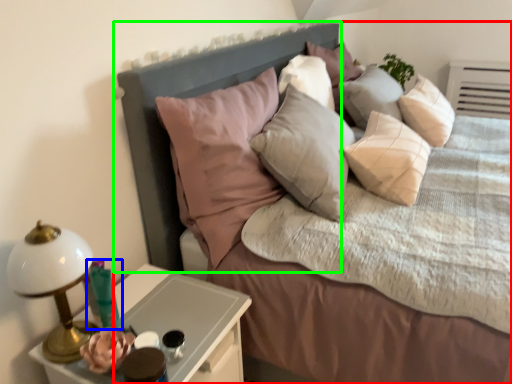
Question: Based on their relative distances, which object is farther from bed (highlighted by a red box)? Choose from candle holder (highlighted by a blue box) and headboard (highlighted by a green box).

Choices:
 (A) candle holder
 (B) headboard

Answer: (A)